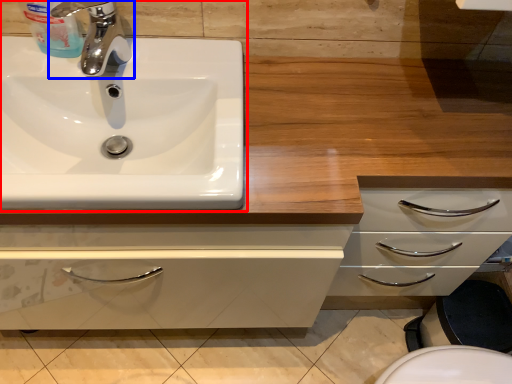
Question: Among these objects, which one is farthest to the camera, sink (highlighted by a red box) or tap (highlighted by a blue box)?

Choices:
 (A) sink
 (B) tap

Answer: (B)